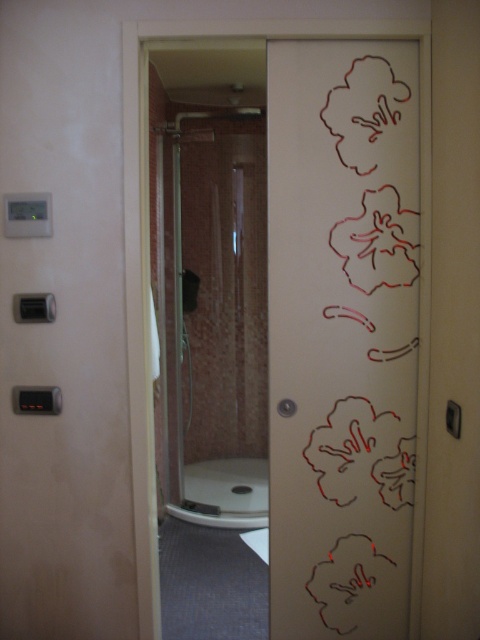
Who is taller, transparent glass door at right or clear glass shower at center?

With more height is clear glass shower at center.

This screenshot has width=480, height=640. Describe the element at coordinates (342, 333) in the screenshot. I see `transparent glass door at right` at that location.

At what (x,y) coordinates should I click in order to perform the action: click on transparent glass door at right. Please return your answer as a coordinate pair (x, y). Image resolution: width=480 pixels, height=640 pixels. Looking at the image, I should click on (342, 333).